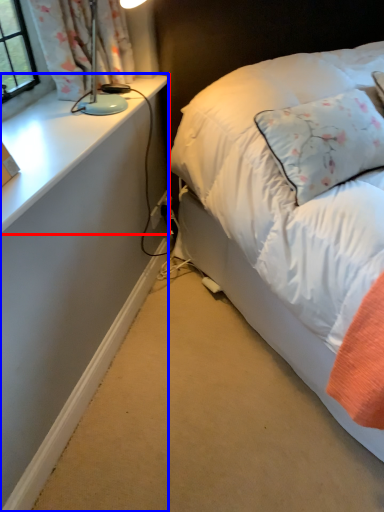
Question: Which object appears closest to the camera in this image, table (highlighted by a red box) or desk (highlighted by a blue box)?

Choices:
 (A) table
 (B) desk

Answer: (A)